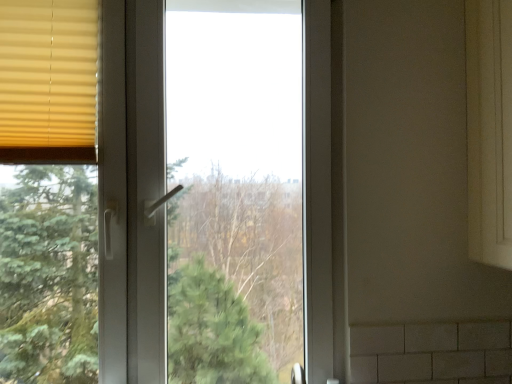
Question: Does white plastic window at center turn towards matte yellow blinds at left?

Choices:
 (A) yes
 (B) no

Answer: (A)

Question: Considering the relative sizes of white plastic window at center and matte yellow blinds at left in the image provided, is white plastic window at center shorter than matte yellow blinds at left?

Choices:
 (A) no
 (B) yes

Answer: (A)

Question: From the image's perspective, is white plastic window at center beneath matte yellow blinds at left?

Choices:
 (A) yes
 (B) no

Answer: (A)

Question: Can you see white plastic window at center touching matte yellow blinds at left?

Choices:
 (A) no
 (B) yes

Answer: (A)

Question: Is matte yellow blinds at left at the back of white plastic window at center?

Choices:
 (A) yes
 (B) no

Answer: (A)

Question: From a real-world perspective, is white plastic window at center located higher than matte yellow blinds at left?

Choices:
 (A) yes
 (B) no

Answer: (B)

Question: Is matte yellow blinds at left positioned in front of white plastic window at center?

Choices:
 (A) yes
 (B) no

Answer: (B)

Question: Does matte yellow blinds at left appear on the left side of white plastic window at center?

Choices:
 (A) no
 (B) yes

Answer: (B)

Question: Is matte yellow blinds at left oriented away from white plastic window at center?

Choices:
 (A) no
 (B) yes

Answer: (B)

Question: Is matte yellow blinds at left oriented towards white plastic window at center?

Choices:
 (A) no
 (B) yes

Answer: (B)

Question: Considering the relative positions of matte yellow blinds at left and white plastic window at center in the image provided, is matte yellow blinds at left behind white plastic window at center?

Choices:
 (A) yes
 (B) no

Answer: (A)

Question: Does matte yellow blinds at left have a greater height compared to white plastic window at center?

Choices:
 (A) no
 (B) yes

Answer: (A)

Question: Is point (104, 304) closer or farther from the camera than point (24, 79)?

Choices:
 (A) farther
 (B) closer

Answer: (A)